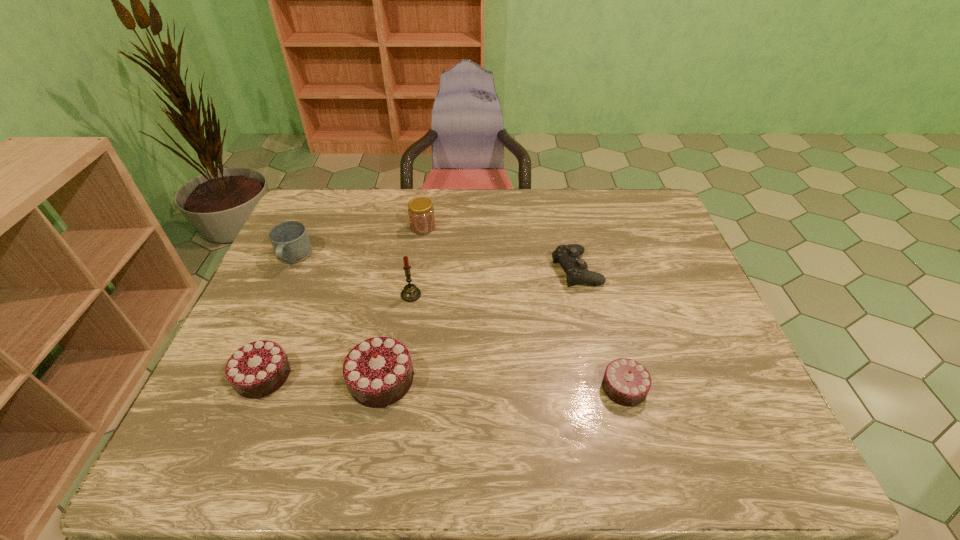
Locate an element on the screen. The image size is (960, 540). free region that satisfies the following two spatial constraints: 1. on the side of the mug with the handle; 2. on the right side of the control is located at coordinates (287, 269).

This screenshot has width=960, height=540. I want to click on vacant region that satisfies the following two spatial constraints: 1. on the front side of the shortest chocolate cake; 2. on the right side of the leftmost chocolate cake, so click(x=258, y=388).